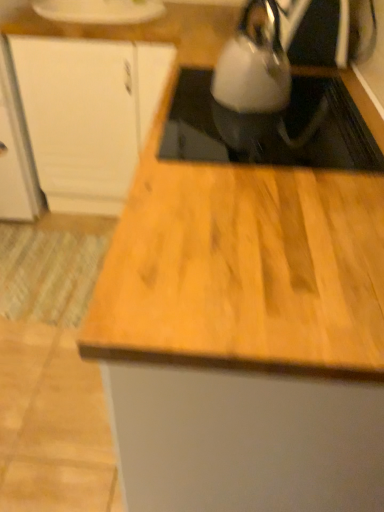
Question: In the image, is satin silver kettle at upper right on the left side or the right side of white matte cabinet at upper left?

Choices:
 (A) left
 (B) right

Answer: (B)

Question: Relative to white matte cabinet at upper left, is satin silver kettle at upper right in front or behind?

Choices:
 (A) front
 (B) behind

Answer: (A)

Question: Based on their relative distances, which object is farther from the white matte cabinet at upper left?

Choices:
 (A) satin silver kettle at upper right
 (B) white glossy kettle at upper center

Answer: (B)

Question: Estimate the real-world distances between objects in this image. Which object is closer to the white glossy kettle at upper center?

Choices:
 (A) satin silver kettle at upper right
 (B) white matte cabinet at upper left

Answer: (A)